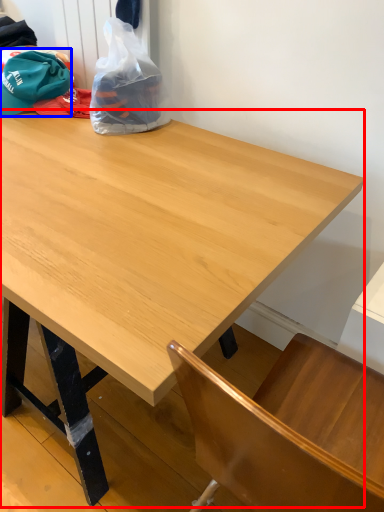
Question: Among these objects, which one is nearest to the camera, table (highlighted by a red box) or baseball hat (highlighted by a blue box)?

Choices:
 (A) table
 (B) baseball hat

Answer: (A)